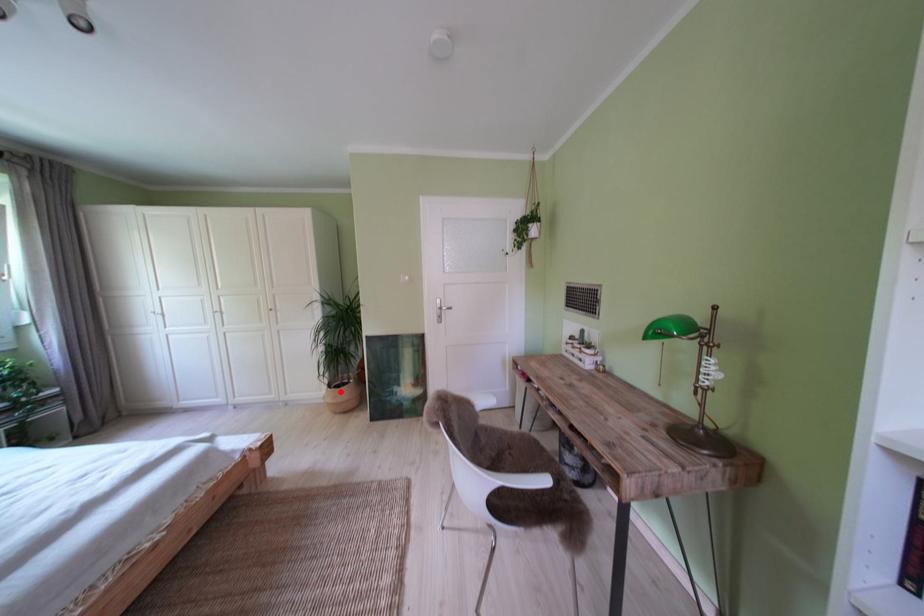
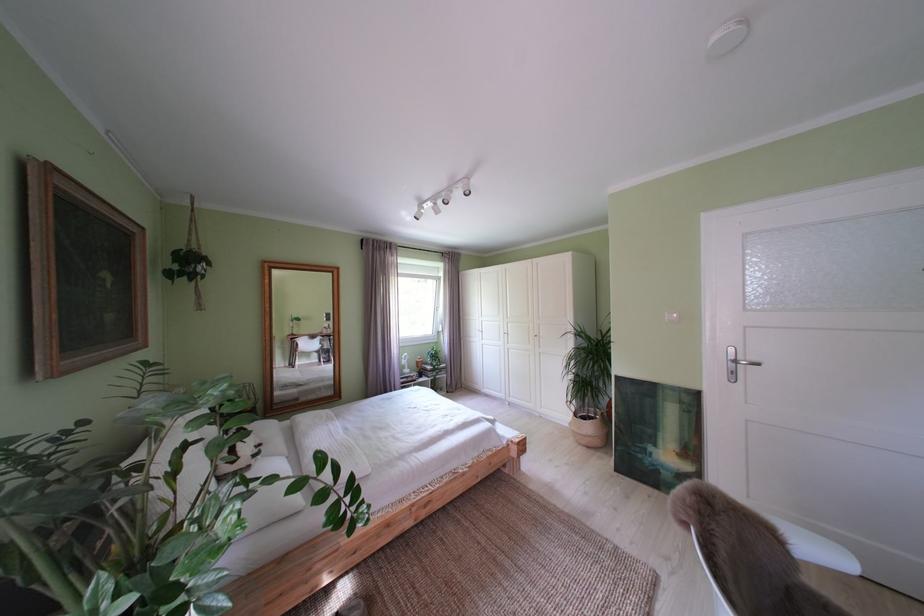
The point at the highlighted location is marked in the first image. Where is the corresponding point in the second image?

(587, 419)